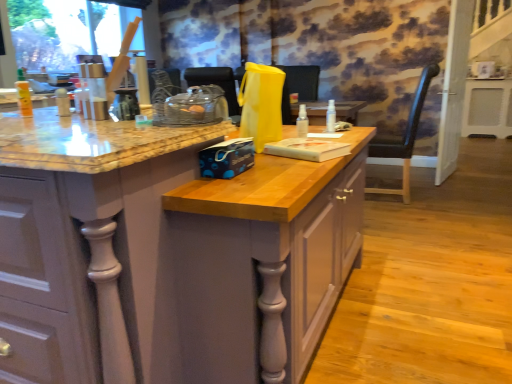
How much space does transparent plastic spray bottle at center, the 2th bottle when ordered from right to left, occupy vertically?

6.03 inches.

Find the location of `matte wood cabinet at center`. matte wood cabinet at center is located at coordinates (89, 247).

You are a GUI agent. You are given a task and a screenshot of the screen. Output one action in this format:
    pyautogui.click(x=<x>, y=<y>)
    Task: Click on the transparent plastic spray bottle at center, which is counted as the 1th bottle, starting from the left
    The width and height of the screenshot is (512, 384).
    Given the screenshot: What is the action you would take?
    pyautogui.click(x=302, y=122)

Are transparent plastic spray bottle at center, positioned as the first bottle in back-to-front order, and transparent plastic spray bottle at center, which is counted as the 1th bottle, starting from the left, beside each other?

No, transparent plastic spray bottle at center, positioned as the first bottle in back-to-front order, is not making contact with transparent plastic spray bottle at center, which is counted as the 1th bottle, starting from the left.

Where is `bottle that is above the transparent plastic spray bottle at center, which is counted as the 1th bottle, starting from the left (from the image's perspective)`? This screenshot has height=384, width=512. bottle that is above the transparent plastic spray bottle at center, which is counted as the 1th bottle, starting from the left (from the image's perspective) is located at coordinates (331, 117).

Does transparent plastic spray bottle at center, arranged as the second bottle when viewed from the left, appear on the left side of transparent plastic spray bottle at center, the first bottle when ordered from front to back?

Incorrect, transparent plastic spray bottle at center, arranged as the second bottle when viewed from the left, is not on the left side of transparent plastic spray bottle at center, the first bottle when ordered from front to back.

Is point (329, 104) positioned before point (298, 133)?

No, (329, 104) is further to viewer.

Which point is more distant from viewer, (69, 257) or (328, 111)?

Positioned behind is point (328, 111).

The width and height of the screenshot is (512, 384). There is a matte wood cabinet at center. What are the coordinates of `the 2nd bottle above it (from the image's perspective)` in the screenshot? It's located at (331, 117).

Does matte wood cabinet at center turn towards transparent plastic spray bottle at center, which appears as the second bottle when viewed from the front?

No, matte wood cabinet at center is not facing towards transparent plastic spray bottle at center, which appears as the second bottle when viewed from the front.

In the scene shown: Is matte wood cabinet at center directly adjacent to transparent plastic spray bottle at center, the 1th bottle positioned from the right?

There is a gap between matte wood cabinet at center and transparent plastic spray bottle at center, the 1th bottle positioned from the right.

Measure the distance between white plastic heater at right and matte wood cabinet at center.

white plastic heater at right and matte wood cabinet at center are 5.49 meters apart from each other.

Image resolution: width=512 pixels, height=384 pixels. Find the location of `table that is behind the matte wood cabinet at center`. table that is behind the matte wood cabinet at center is located at coordinates (488, 108).

Between white plastic heater at right and matte wood cabinet at center, which one appears on the right side from the viewer's perspective?

From the viewer's perspective, white plastic heater at right appears more on the right side.

Does point (466, 120) lie in front of point (133, 361)?

That is False.

Considering the sizes of objects white glossy screen door at right and matte wood cabinet at center in the image provided, who is bigger, white glossy screen door at right or matte wood cabinet at center?

Bigger between the two is matte wood cabinet at center.

Who is taller, white glossy screen door at right or matte wood cabinet at center?

With more height is white glossy screen door at right.

Does white glossy screen door at right appear on the left side of matte wood cabinet at center?

No, white glossy screen door at right is not to the left of matte wood cabinet at center.

Considering the positions of points (460, 76) and (110, 200), is point (460, 76) closer to camera compared to point (110, 200)?

No, (460, 76) is further to viewer.

Does white glossy screen door at right have a lesser height compared to white plastic heater at right?

In fact, white glossy screen door at right may be taller than white plastic heater at right.

The image size is (512, 384). I want to click on table behind the white glossy screen door at right, so click(488, 108).

Looking at this image, is white glossy screen door at right located outside white plastic heater at right?

That's correct, white glossy screen door at right is outside of white plastic heater at right.

From the image's perspective, is transparent plastic spray bottle at center, which is the second bottle from back to front, located above or below transparent plastic spray bottle at center, positioned as the first bottle in back-to-front order?

Based on their image positions, transparent plastic spray bottle at center, which is the second bottle from back to front, is located beneath transparent plastic spray bottle at center, positioned as the first bottle in back-to-front order.

Is transparent plastic spray bottle at center, which is counted as the 1th bottle, starting from the left, further to the viewer compared to transparent plastic spray bottle at center, arranged as the second bottle when viewed from the left?

No, transparent plastic spray bottle at center, which is counted as the 1th bottle, starting from the left, is in front of transparent plastic spray bottle at center, arranged as the second bottle when viewed from the left.

Is transparent plastic spray bottle at center, the 2th bottle when ordered from right to left, turned away from transparent plastic spray bottle at center, which appears as the second bottle when viewed from the front?

Yes, transparent plastic spray bottle at center, the 2th bottle when ordered from right to left, is positioned with its back facing transparent plastic spray bottle at center, which appears as the second bottle when viewed from the front.

Between transparent plastic spray bottle at center, which is the second bottle from back to front, and transparent plastic spray bottle at center, positioned as the first bottle in back-to-front order, which one has larger width?

With larger width is transparent plastic spray bottle at center, positioned as the first bottle in back-to-front order.

Find the location of a particular element. The image size is (512, 384). chair on the left of white plastic heater at right is located at coordinates (404, 138).

Are white plastic heater at right and black leather chair at right located far from each other?

Indeed, white plastic heater at right is not near black leather chair at right.

From the picture: From the image's perspective, is white plastic heater at right on top of black leather chair at right?

Yes, from the image's perspective, white plastic heater at right is above black leather chair at right.

Find the location of a particular element. The image size is (512, 384). bottle that is on the right side of transparent plastic spray bottle at center, the 2th bottle when ordered from right to left is located at coordinates (331, 117).

This screenshot has width=512, height=384. Identify the location of cabinetry that is in front of the transparent plastic spray bottle at center, positioned as the first bottle in back-to-front order. (89, 247).

Estimate the real-world distances between objects in this image. Which object is closer to transparent plastic spray bottle at center, the first bottle when ordered from front to back, white plastic heater at right or white glossy screen door at right?

white glossy screen door at right is closer to transparent plastic spray bottle at center, the first bottle when ordered from front to back.

Based on their spatial positions, is matte wood cabinet at center or black leather chair at right closer to white glossy screen door at right?

black leather chair at right.

From the image, which object appears to be nearer to white glossy screen door at right, black leather chair at right or transparent plastic spray bottle at center, the first bottle when ordered from front to back?

black leather chair at right lies closer to white glossy screen door at right than the other object.

Which object lies nearer to the anchor point transparent plastic spray bottle at center, the 1th bottle positioned from the right, matte wood cabinet at center or white glossy screen door at right?

matte wood cabinet at center lies closer to transparent plastic spray bottle at center, the 1th bottle positioned from the right, than the other object.

From the image, which object appears to be farther from transparent plastic spray bottle at center, the first bottle when ordered from front to back, white glossy screen door at right or black leather chair at right?

white glossy screen door at right is positioned further to the anchor transparent plastic spray bottle at center, the first bottle when ordered from front to back.

From the image, which object appears to be farther from transparent plastic spray bottle at center, positioned as the first bottle in back-to-front order, white plastic heater at right or white glossy screen door at right?

The object further to transparent plastic spray bottle at center, positioned as the first bottle in back-to-front order, is white plastic heater at right.

From the image, which object appears to be nearer to transparent plastic spray bottle at center, the first bottle when ordered from front to back, transparent plastic spray bottle at center, arranged as the second bottle when viewed from the left, or matte wood cabinet at center?

Based on the image, transparent plastic spray bottle at center, arranged as the second bottle when viewed from the left, appears to be nearer to transparent plastic spray bottle at center, the first bottle when ordered from front to back.

Estimate the real-world distances between objects in this image. Which object is further from matte wood cabinet at center, transparent plastic spray bottle at center, which appears as the second bottle when viewed from the front, or transparent plastic spray bottle at center, the first bottle when ordered from front to back?

transparent plastic spray bottle at center, which appears as the second bottle when viewed from the front, lies further to matte wood cabinet at center than the other object.

You are a GUI agent. You are given a task and a screenshot of the screen. Output one action in this format:
    pyautogui.click(x=<x>, y=<y>)
    Task: Click on the chair situated between transparent plastic spray bottle at center, the 1th bottle positioned from the right, and white glossy screen door at right from left to right
    The width and height of the screenshot is (512, 384).
    Given the screenshot: What is the action you would take?
    pyautogui.click(x=404, y=138)

You are a GUI agent. You are given a task and a screenshot of the screen. Output one action in this format:
    pyautogui.click(x=<x>, y=<y>)
    Task: Click on the screen door between matte wood cabinet at center and white plastic heater at right in the front-back direction
    
    Given the screenshot: What is the action you would take?
    pyautogui.click(x=454, y=87)

Where is `bottle located between transparent plastic spray bottle at center, the first bottle when ordered from front to back, and white plastic heater at right in the depth direction`? Image resolution: width=512 pixels, height=384 pixels. bottle located between transparent plastic spray bottle at center, the first bottle when ordered from front to back, and white plastic heater at right in the depth direction is located at coordinates pyautogui.click(x=331, y=117).

In order to click on chair positioned between matte wood cabinet at center and white glossy screen door at right from near to far in this screenshot , I will do `click(404, 138)`.